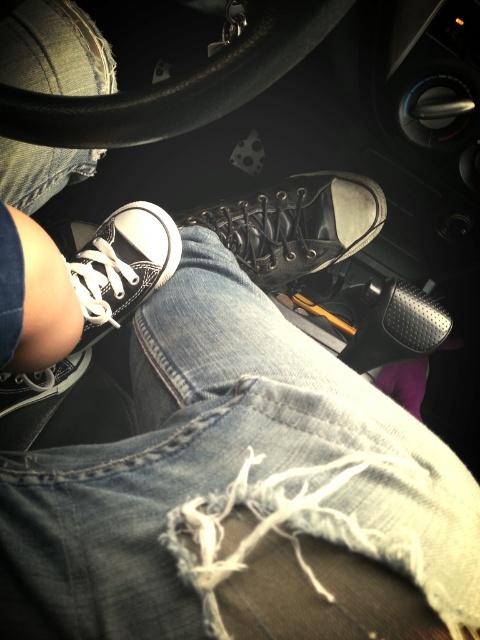
Question: Which object is the closest to the leather/black shoe at center?

Choices:
 (A) black matte shoe at center
 (B) denim at center

Answer: (A)

Question: Is white canvas shoe at lower left to the right of black matte shoe at center from the viewer's perspective?

Choices:
 (A) yes
 (B) no

Answer: (B)

Question: Observing the image, what is the correct spatial positioning of leather/black shoe at center in reference to white canvas shoe at lower left?

Choices:
 (A) left
 (B) right

Answer: (B)

Question: Which point is closer to the camera?

Choices:
 (A) (263, 236)
 (B) (156, 282)
 (C) (402, 292)

Answer: (B)

Question: Based on their relative distances, which object is nearer to the denim at center?

Choices:
 (A) leather/black shoe at center
 (B) white canvas shoe at lower left
 (C) black matte shoe at center

Answer: (B)

Question: In this image, where is white canvas shoe at lower left located relative to black matte shoe at center?

Choices:
 (A) right
 (B) left

Answer: (B)